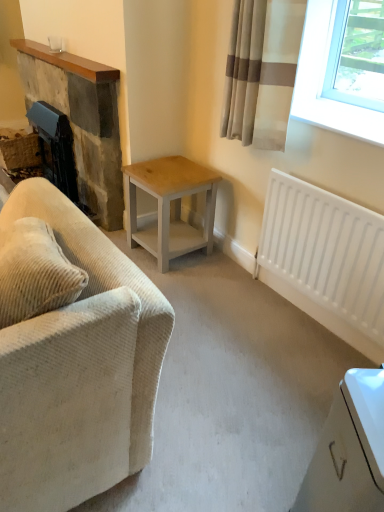
This screenshot has width=384, height=512. I want to click on light wood/grey painted table at center, so click(169, 206).

Locate an element on the screen. beige fabric curtain at upper right is located at coordinates (261, 71).

What are the coordinates of `beige corduroy couch at left` in the screenshot? It's located at (79, 369).

From the image's perspective, which one is positioned lower, rustic stone fireplace at left or beige fabric curtain at upper right?

beige fabric curtain at upper right is shown below in the image.

From their relative heights in the image, would you say rustic stone fireplace at left is taller or shorter than beige fabric curtain at upper right?

Clearly, rustic stone fireplace at left is taller compared to beige fabric curtain at upper right.

How distant is rustic stone fireplace at left from beige fabric curtain at upper right?

rustic stone fireplace at left is 3.38 feet away from beige fabric curtain at upper right.

Between point (106, 86) and point (234, 137), which one is positioned in front?

The point (234, 137) is closer.

Considering the relative sizes of light wood/grey painted table at center and rustic stone fireplace at left in the image provided, is light wood/grey painted table at center smaller than rustic stone fireplace at left?

Yes.

Looking at this image, which of these two, light wood/grey painted table at center or rustic stone fireplace at left, is wider?

light wood/grey painted table at center.

Is light wood/grey painted table at center surrounding rustic stone fireplace at left?

No, rustic stone fireplace at left is not a part of light wood/grey painted table at center.

Is light wood/grey painted table at center turned away from rustic stone fireplace at left?

No, light wood/grey painted table at center is not facing away from rustic stone fireplace at left.

Is point (344, 310) closer to camera compared to point (211, 200)?

That is True.

Is white matte radiator at lower right inside the boundaries of light wood/grey painted table at center, or outside?

white matte radiator at lower right is outside light wood/grey painted table at center.

In the scene shown: From a real-world perspective, is white matte radiator at lower right above or below light wood/grey painted table at center?

white matte radiator at lower right is situated higher than light wood/grey painted table at center in the real world.

Is white matte radiator at lower right shorter than light wood/grey painted table at center?

In fact, white matte radiator at lower right may be taller than light wood/grey painted table at center.

Can you confirm if beige fabric curtain at upper right is bigger than light wood/grey painted table at center?

Incorrect, beige fabric curtain at upper right is not larger than light wood/grey painted table at center.

Looking at their sizes, would you say beige fabric curtain at upper right is wider or thinner than light wood/grey painted table at center?

Considering their sizes, beige fabric curtain at upper right looks slimmer than light wood/grey painted table at center.

From the picture: From the image's perspective, which is above, beige fabric curtain at upper right or light wood/grey painted table at center?

beige fabric curtain at upper right, from the image's perspective.

Is beige fabric curtain at upper right facing towards light wood/grey painted table at center?

No.

Is beige corduroy couch at left oriented towards white matte radiator at lower right?

No, beige corduroy couch at left is not facing towards white matte radiator at lower right.

Which is behind, point (89, 429) or point (306, 271)?

Positioned behind is point (306, 271).

Is beige corduroy couch at left thinner than white matte radiator at lower right?

No.

Considering the relative positions of beige corduroy couch at left and white matte radiator at lower right in the image provided, is beige corduroy couch at left behind white matte radiator at lower right?

No, it is not.

From the image's perspective, which one is positioned higher, white matte radiator at lower right or rustic stone fireplace at left?

rustic stone fireplace at left, from the image's perspective.

Is white matte radiator at lower right looking in the opposite direction of rustic stone fireplace at left?

No, white matte radiator at lower right's orientation is not away from rustic stone fireplace at left.

Can you confirm if white matte radiator at lower right is positioned to the right of rustic stone fireplace at left?

Correct, you'll find white matte radiator at lower right to the right of rustic stone fireplace at left.

Is rustic stone fireplace at left completely or partially inside white matte radiator at lower right?

No, rustic stone fireplace at left is not surrounded by white matte radiator at lower right.

Is white matte radiator at lower right looking in the opposite direction of beige fabric curtain at upper right?

No, beige fabric curtain at upper right is not at the back of white matte radiator at lower right.

Is the position of white matte radiator at lower right more distant than that of beige fabric curtain at upper right?

No, it is in front of beige fabric curtain at upper right.

From a real-world perspective, between white matte radiator at lower right and beige fabric curtain at upper right, who is vertically lower?

From a 3D spatial view, white matte radiator at lower right is below.

Which of these two, white matte radiator at lower right or beige fabric curtain at upper right, is thinner?

With smaller width is white matte radiator at lower right.

Find the location of a particular element. Image resolution: width=384 pixels, height=512 pixels. curtain below the rustic stone fireplace at left (from the image's perspective) is located at coordinates (261, 71).

The height and width of the screenshot is (512, 384). In order to click on table beneath the rustic stone fireplace at left (from a real-world perspective) in this screenshot , I will do `click(169, 206)`.

Considering their positions, is beige corduroy couch at left positioned further to beige fabric curtain at upper right than white matte radiator at lower right?

Based on the image, beige corduroy couch at left appears to be further to beige fabric curtain at upper right.

Which object lies nearer to the anchor point beige fabric curtain at upper right, light wood/grey painted table at center or rustic stone fireplace at left?

The object closer to beige fabric curtain at upper right is light wood/grey painted table at center.

Based on their spatial positions, is light wood/grey painted table at center or white matte radiator at lower right further from rustic stone fireplace at left?

white matte radiator at lower right is positioned further to the anchor rustic stone fireplace at left.

Looking at the image, which one is located further to white matte radiator at lower right, beige fabric curtain at upper right or light wood/grey painted table at center?

light wood/grey painted table at center is positioned further to the anchor white matte radiator at lower right.

When comparing their distances from rustic stone fireplace at left, does white matte radiator at lower right or beige fabric curtain at upper right seem closer?

The object closer to rustic stone fireplace at left is beige fabric curtain at upper right.

When comparing their distances from beige corduroy couch at left, does white matte radiator at lower right or rustic stone fireplace at left seem closer?

white matte radiator at lower right is closer to beige corduroy couch at left.

When comparing their distances from beige corduroy couch at left, does beige fabric curtain at upper right or light wood/grey painted table at center seem further?

beige fabric curtain at upper right is further to beige corduroy couch at left.

Estimate the real-world distances between objects in this image. Which object is further from rustic stone fireplace at left, beige corduroy couch at left or white matte radiator at lower right?

beige corduroy couch at left.

Identify the location of table located between beige corduroy couch at left and rustic stone fireplace at left in the depth direction. The image size is (384, 512). [169, 206].

The image size is (384, 512). I want to click on table located between rustic stone fireplace at left and white matte radiator at lower right in the left-right direction, so click(169, 206).

Find the location of a particular element. The image size is (384, 512). curtain between beige corduroy couch at left and rustic stone fireplace at left in the front-back direction is located at coordinates (261, 71).

You are a GUI agent. You are given a task and a screenshot of the screen. Output one action in this format:
    pyautogui.click(x=<x>, y=<y>)
    Task: Click on the table that lies between beige fabric curtain at upper right and white matte radiator at lower right from top to bottom
    
    Given the screenshot: What is the action you would take?
    pyautogui.click(x=169, y=206)